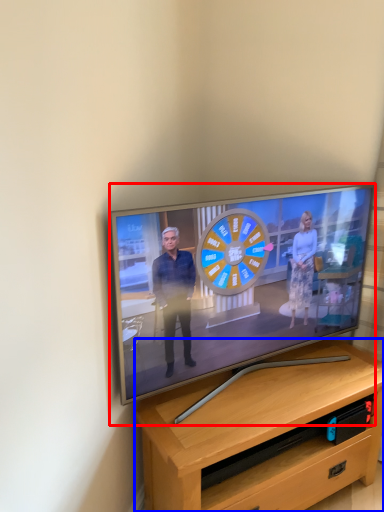
Question: Among these objects, which one is farthest to the camera, television (highlighted by a red box) or desk (highlighted by a blue box)?

Choices:
 (A) television
 (B) desk

Answer: (B)